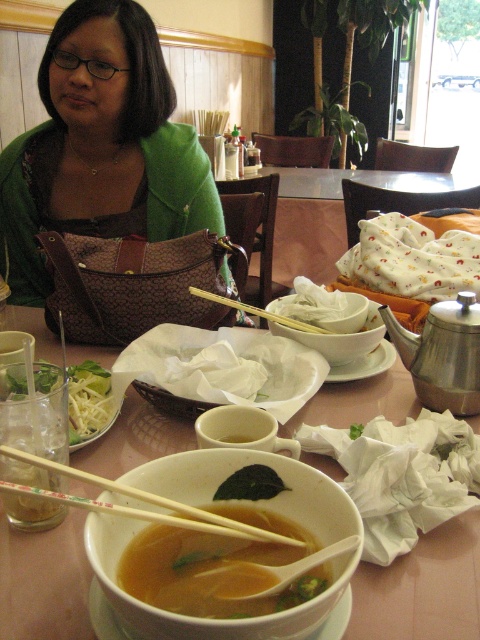
Between green fabric shirt at upper left and translucent glass bowl at center, which one has more height?

With more height is green fabric shirt at upper left.

Is green fabric shirt at upper left to the left of translucent glass bowl at center from the viewer's perspective?

Indeed, green fabric shirt at upper left is positioned on the left side of translucent glass bowl at center.

Where is `green fabric shirt at upper left`? This screenshot has width=480, height=640. green fabric shirt at upper left is located at coordinates (100, 147).

The image size is (480, 640). I want to click on green fabric shirt at upper left, so click(x=100, y=147).

Find the location of a particular element. white fabric at center is located at coordinates (339, 212).

Consider the image. Is white fabric at center closer to the viewer compared to wooden chopsticks at center?

No, it is not.

Which is behind, point (240, 188) or point (235, 300)?

The point (240, 188) is more distant.

You are a GUI agent. You are given a task and a screenshot of the screen. Output one action in this format:
    pyautogui.click(x=<x>, y=<y>)
    Task: Click on the white fabric at center
    Image resolution: width=480 pixels, height=640 pixels.
    Given the screenshot: What is the action you would take?
    pyautogui.click(x=339, y=212)

From the picture: Is translucent glass cup at lower left closer to the viewer compared to wooden chopsticks at center?

Yes, it is.

Which is below, translucent glass cup at lower left or wooden chopsticks at center?

translucent glass cup at lower left is below.

Find the location of a particular element. translucent glass cup at lower left is located at coordinates (88, 403).